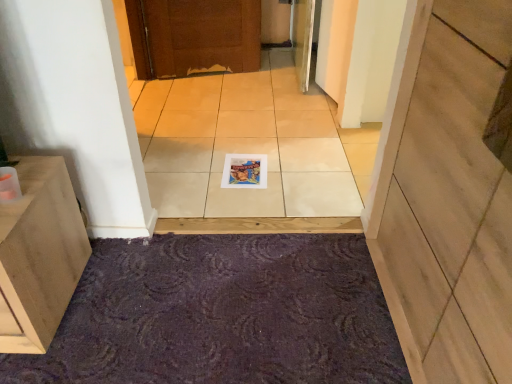
Question: Choose the correct answer: Is matte paper magazine at center inside white glossy tile at center or outside it?

Choices:
 (A) inside
 (B) outside

Answer: (A)

Question: In the image, is matte paper magazine at center positioned in front of or behind white glossy tile at center?

Choices:
 (A) front
 (B) behind

Answer: (B)

Question: Which is nearer to the matte paper magazine at center?

Choices:
 (A) purple textured bath mat at lower center
 (B) wooden at center
 (C) white glossy tile at center

Answer: (C)

Question: Considering the real-world distances, which object is closest to the purple textured bath mat at lower center?

Choices:
 (A) matte paper magazine at center
 (B) wooden at center
 (C) white glossy tile at center

Answer: (B)